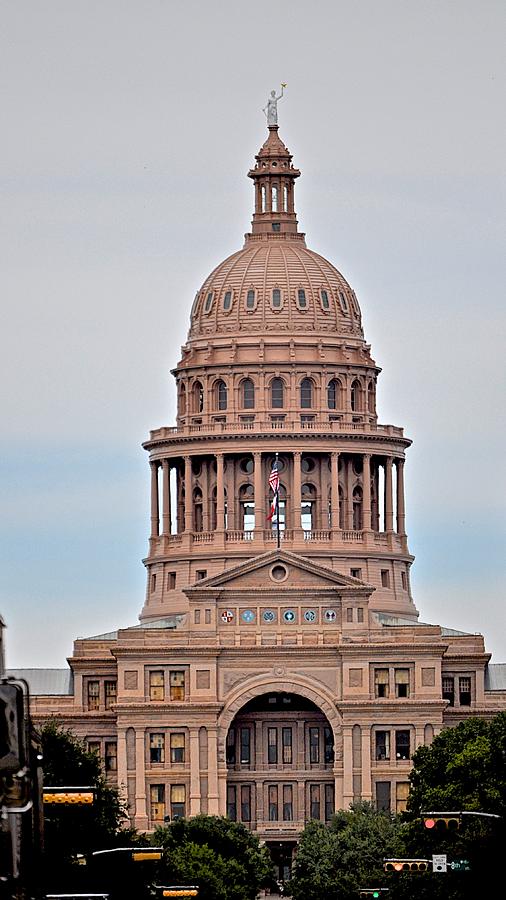
Identify the location of yellow light. (398, 868).